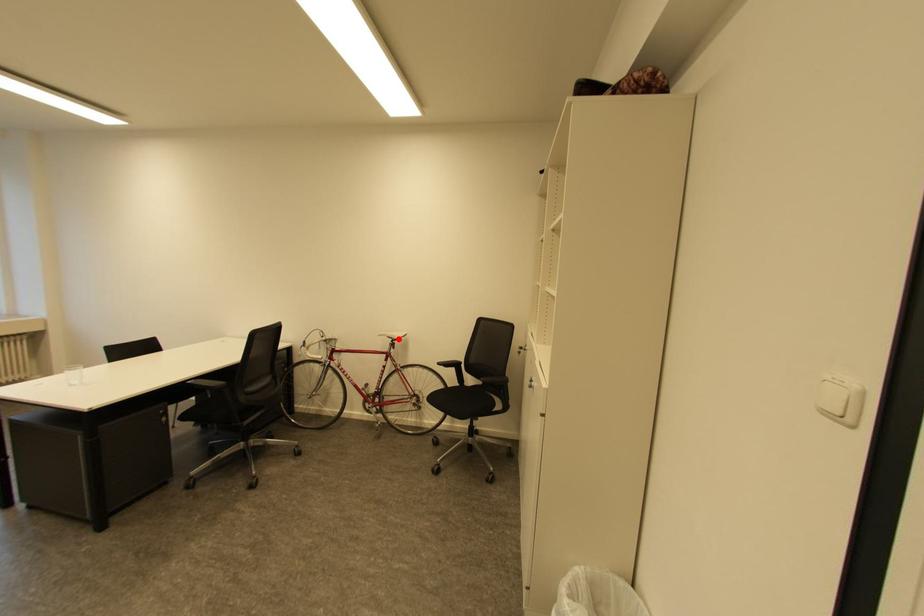
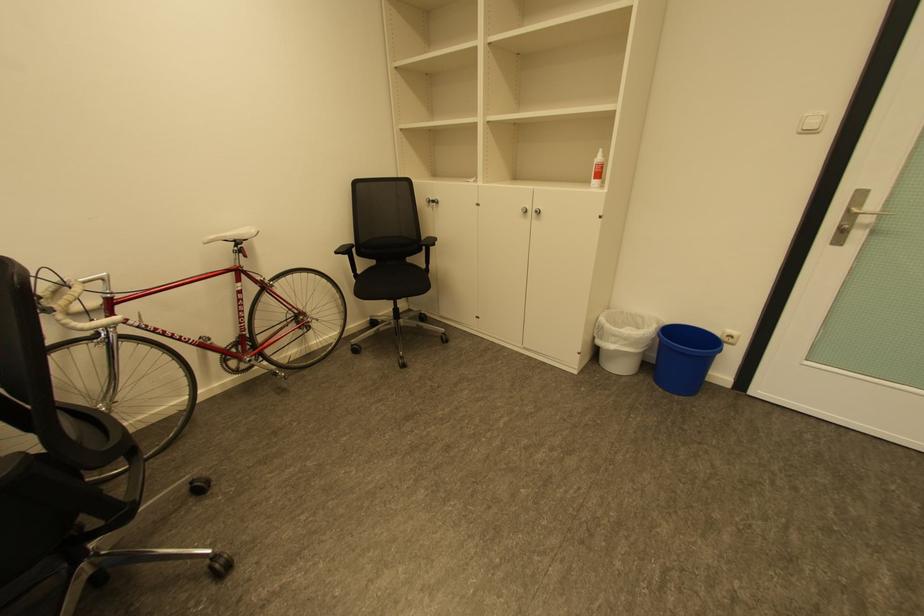
Question: I am providing you with two images of the same scene from different viewpoints. Image1 has a red point marked. In image2, the corresponding 3D location appears at what relative position? Reply with the corresponding letter.

Choices:
 (A) Closer
 (B) Farther

Answer: (A)